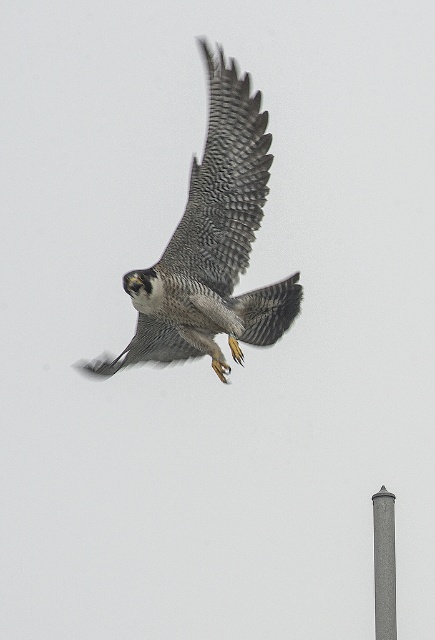
Which is more to the right, speckled feathered eagle at center or gray concrete pole at lower right?

From the viewer's perspective, gray concrete pole at lower right appears more on the right side.

Who is higher up, speckled feathered eagle at center or gray concrete pole at lower right?

speckled feathered eagle at center is higher up.

Image resolution: width=435 pixels, height=640 pixels. Find the location of `speckled feathered eagle at center`. speckled feathered eagle at center is located at coordinates tap(211, 244).

Where is `speckled feathered eagle at center`? The image size is (435, 640). speckled feathered eagle at center is located at coordinates (211, 244).

Can you confirm if speckled feathered eagle at center is taller than gray textured wing at center?

Yes.

Is speckled feathered eagle at center above gray textured wing at center?

Yes.

Is point (241, 236) positioned before point (204, 56)?

No.

This screenshot has width=435, height=640. I want to click on speckled feathered eagle at center, so click(x=211, y=244).

From the picture: Can you confirm if gray textured wing at center is positioned above gray concrete pole at lower right?

Yes, gray textured wing at center is above gray concrete pole at lower right.

Which is more to the left, gray textured wing at center or gray concrete pole at lower right?

gray textured wing at center is more to the left.

Does point (213, 65) come closer to viewer compared to point (378, 502)?

No, it is not.

The image size is (435, 640). I want to click on gray textured wing at center, so click(223, 184).